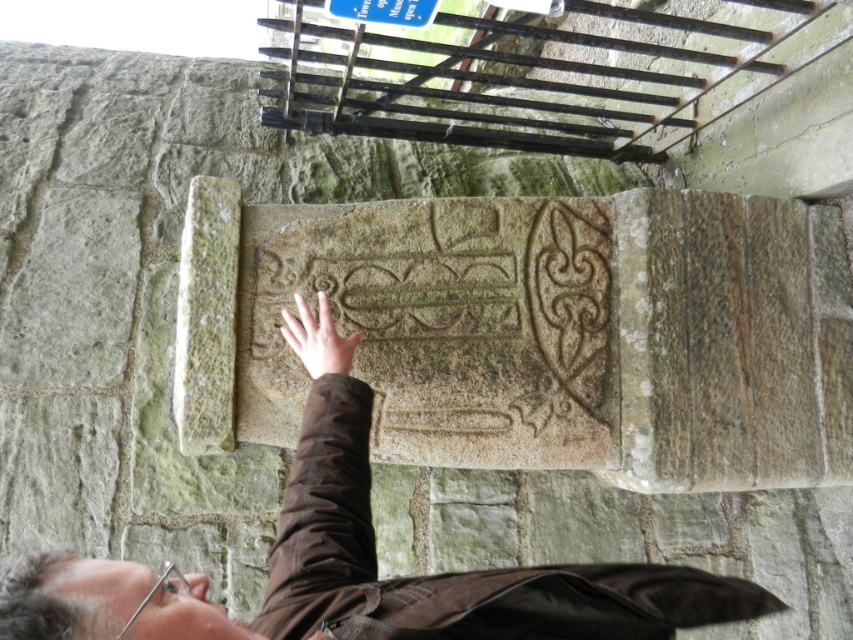
You are an art conservator examining the stone plaque. You notice the brown leather jacket at center and the smooth skin hand at center. Which object is positioned higher on the vertical axis?

The brown leather jacket at center is taller than the smooth skin hand at center, so the brown leather jacket at center is positioned higher on the vertical axis.

You are an art conservator examining the stone plaque. You notice the smooth skin hand at center and the blue plastic sign at upper center. Which object is located to the right of the other?

The blue plastic sign at upper center is located to the right of the smooth skin hand at center because the smooth skin hand at center is positioned on the left side of blue plastic sign at upper center.